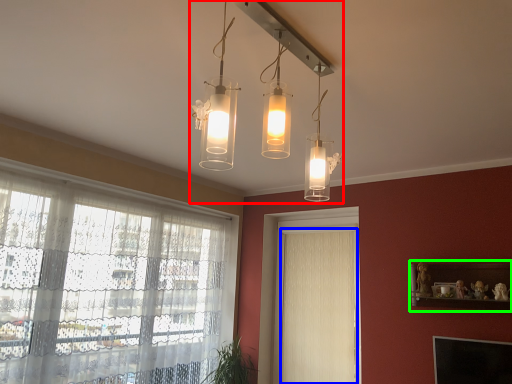
Question: Based on their relative distances, which object is farther from light fixture (highlighted by a red box)? Choose from curtain (highlighted by a blue box) and shelf (highlighted by a green box).

Choices:
 (A) curtain
 (B) shelf

Answer: (A)